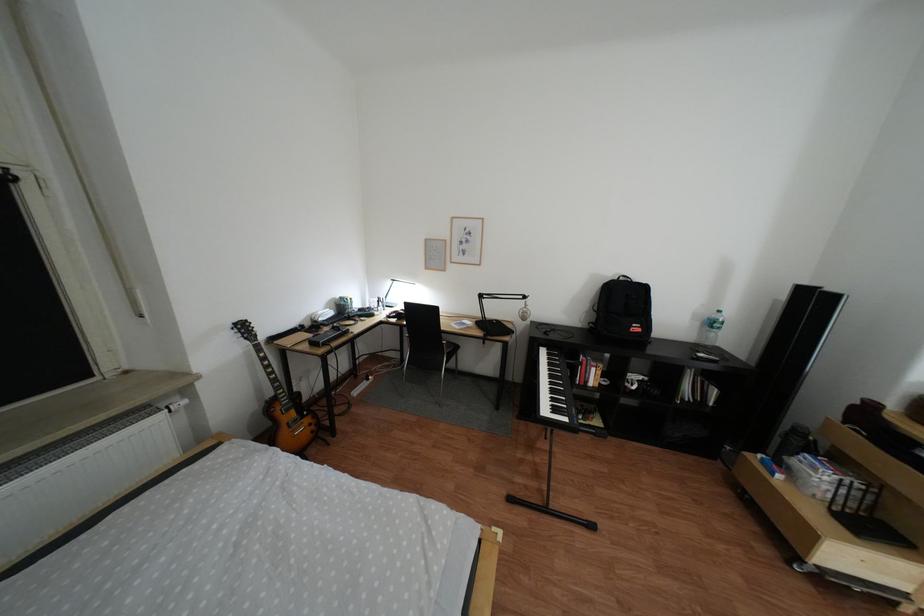
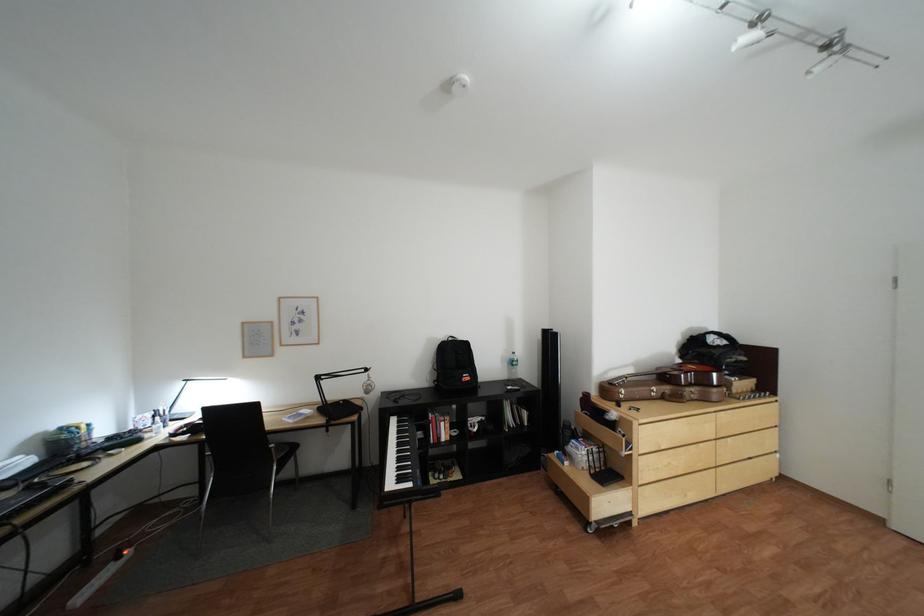
Where in the second image is the point corresponding to point (827, 536) from the first image?

(602, 500)